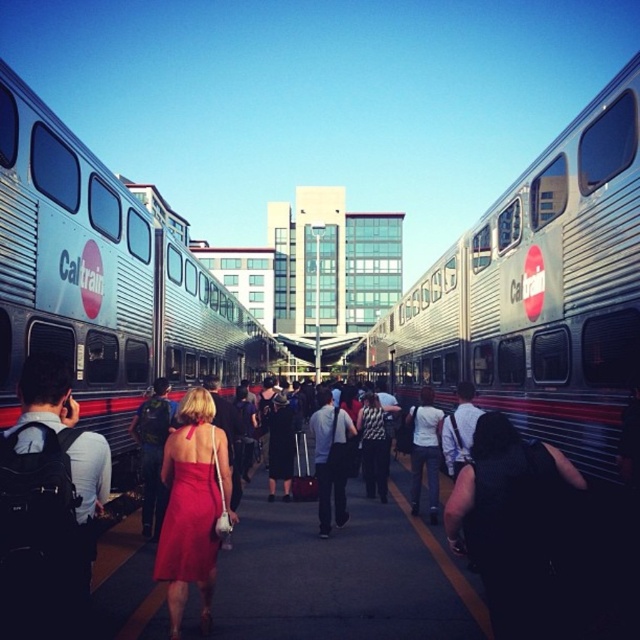
Is silver metallic train at left closer to the viewer compared to matte red dress at center?

Yes.

The width and height of the screenshot is (640, 640). Identify the location of silver metallic train at left. (102, 280).

This screenshot has width=640, height=640. What are the coordinates of `silver metallic train at left` in the screenshot? It's located at (102, 280).

Is matte red dress at center below white shirt at center?

No, matte red dress at center is not below white shirt at center.

Does matte red dress at center have a greater width compared to white shirt at center?

Indeed, matte red dress at center has a greater width compared to white shirt at center.

Is point (186, 476) positioned in front of point (442, 420)?

Yes, it is.

Identify the location of matte red dress at center. This screenshot has width=640, height=640. (188, 515).

Who is higher up, dark gray pants at center or white shirt at center?

Positioned higher is white shirt at center.

Can you confirm if dark gray pants at center is positioned to the right of white shirt at center?

Incorrect, dark gray pants at center is not on the right side of white shirt at center.

Describe the element at coordinates (330, 458) in the screenshot. The height and width of the screenshot is (640, 640). I see `dark gray pants at center` at that location.

Locate an element on the screen. This screenshot has width=640, height=640. dark gray pants at center is located at coordinates (330, 458).